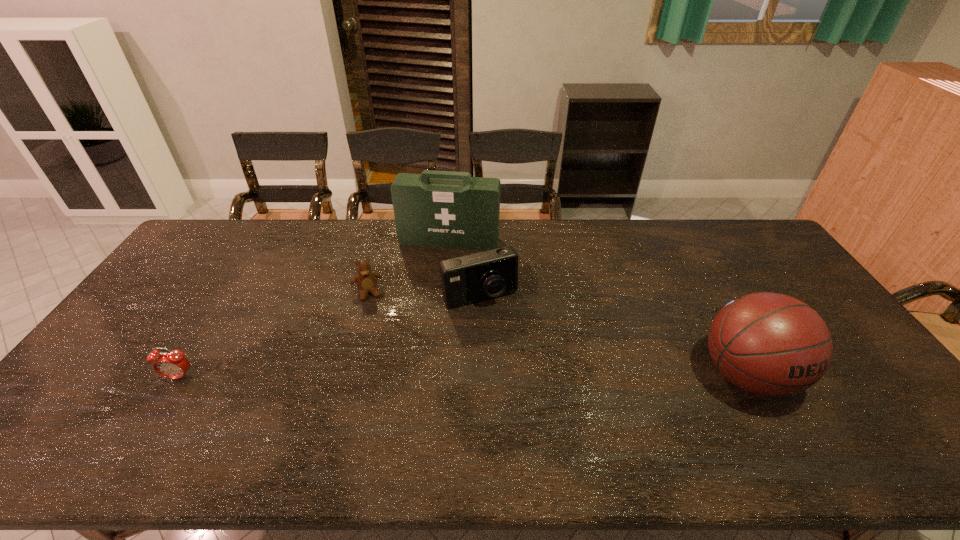
Locate an element on the screen. the leftmost object is located at coordinates (173, 365).

Find the location of `the rightmost object`. the rightmost object is located at coordinates (769, 344).

Image resolution: width=960 pixels, height=540 pixels. Identify the location of teddy bear. (366, 280).

The width and height of the screenshot is (960, 540). I want to click on the first-aid kit, so click(432, 209).

The image size is (960, 540). Identify the location of the third shortest object. (475, 277).

Image resolution: width=960 pixels, height=540 pixels. I want to click on vacant space located on the face of the leftmost object, so click(x=161, y=407).

The width and height of the screenshot is (960, 540). I want to click on free space located on the left of the rightmost object, so click(x=679, y=375).

Locate an element on the screen. The width and height of the screenshot is (960, 540). vacant area situated at the face of the teddy bear is located at coordinates (381, 349).

At what (x,y) coordinates should I click in order to perform the action: click on vacant region located 0.360m at the face of the teddy bear. Please return your answer as a coordinate pair (x, y). The width and height of the screenshot is (960, 540). Looking at the image, I should click on (393, 396).

Identify the location of free space located 0.060m at the face of the teddy bear. This screenshot has height=540, width=960. (373, 315).